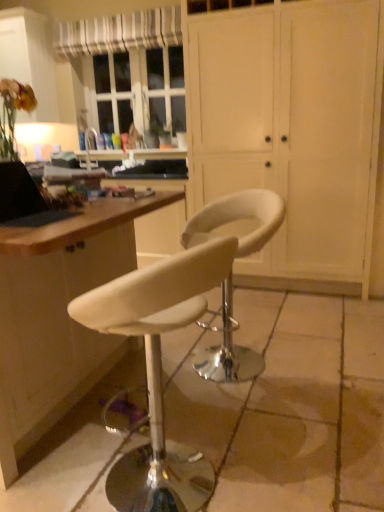
Image resolution: width=384 pixels, height=512 pixels. In order to click on vacant region in front of white leather stool at center, which appears as the first chair when viewed from the back in this screenshot , I will do `click(257, 412)`.